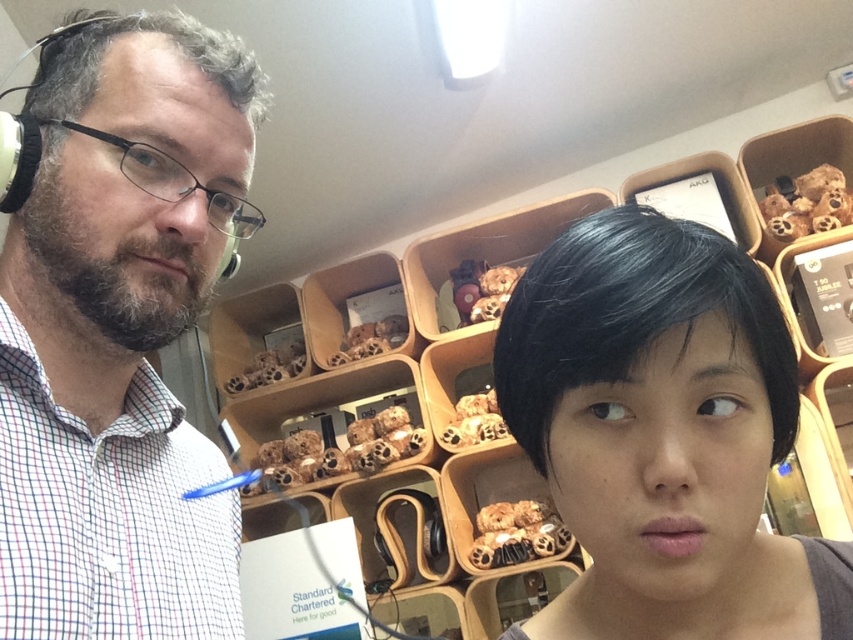
You are a customer in a store and you see the white matte headphones at left and the black matte hair at center. Which object is taller?

The white matte headphones at left is taller than the black matte hair at center.

You are a customer in a store and want to pick up the white matte headphones at left and the satin black earphone at upper left. Which one is located lower?

The white matte headphones at left is below the satin black earphone at upper left, so the white matte headphones at left is located lower.

You are designing a display case for small items. The display case has two compartments. The first compartment must fit the black matte hair at center, and the second must fit the satin black earphone at upper left. Based on the provided information, which compartment should be wider?

The black matte hair at center has a larger width than the satin black earphone at upper left, so the first compartment should be wider to accommodate its greater width.